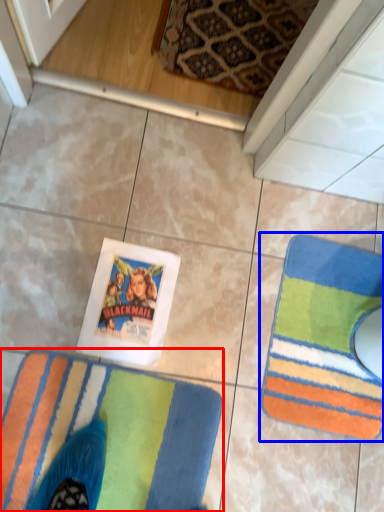
Question: Which object appears closest to the camera in this image, towel (highlighted by a red box) or towel (highlighted by a blue box)?

Choices:
 (A) towel
 (B) towel

Answer: (A)